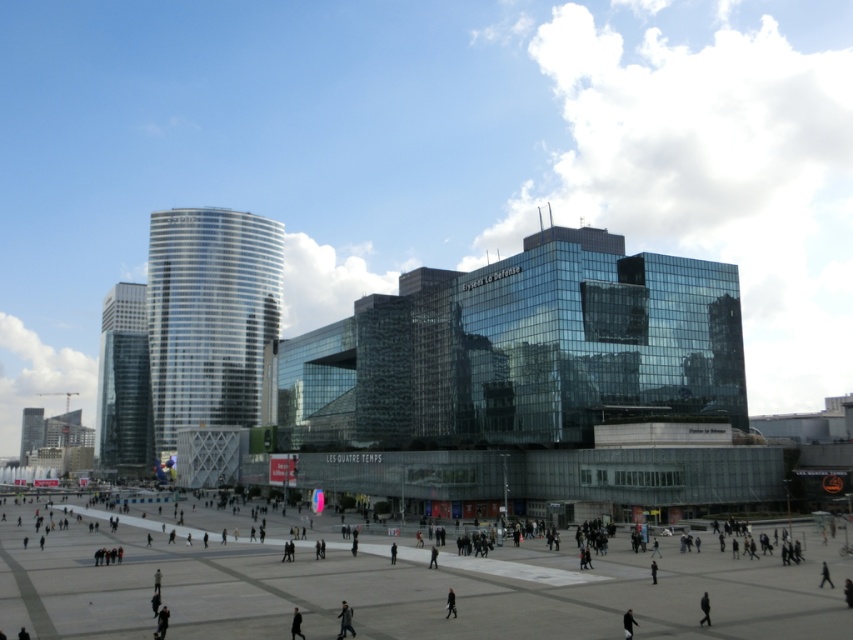
Question: Can you confirm if concrete plaza at center is positioned to the left of dark gray coat at lower center?

Choices:
 (A) yes
 (B) no

Answer: (A)

Question: Is shiny glass tower at center below glassy skyscraper at left?

Choices:
 (A) yes
 (B) no

Answer: (B)

Question: Which of the following is the farthest from the observer?

Choices:
 (A) concrete plaza at center
 (B) dark gray jacket at center
 (C) dark gray coat at lower center
 (D) shiny glass tower at center

Answer: (D)

Question: Does glassy skyscraper at left have a smaller size compared to dark gray coat at lower center?

Choices:
 (A) no
 (B) yes

Answer: (A)

Question: Which object appears closest to the camera in this image?

Choices:
 (A) concrete plaza at center
 (B) glassy skyscraper at left

Answer: (A)

Question: Based on their relative distances, which object is nearer to the dark gray coat at lower center?

Choices:
 (A) dark gray jacket at center
 (B) concrete plaza at center
 (C) shiny glass tower at center

Answer: (A)